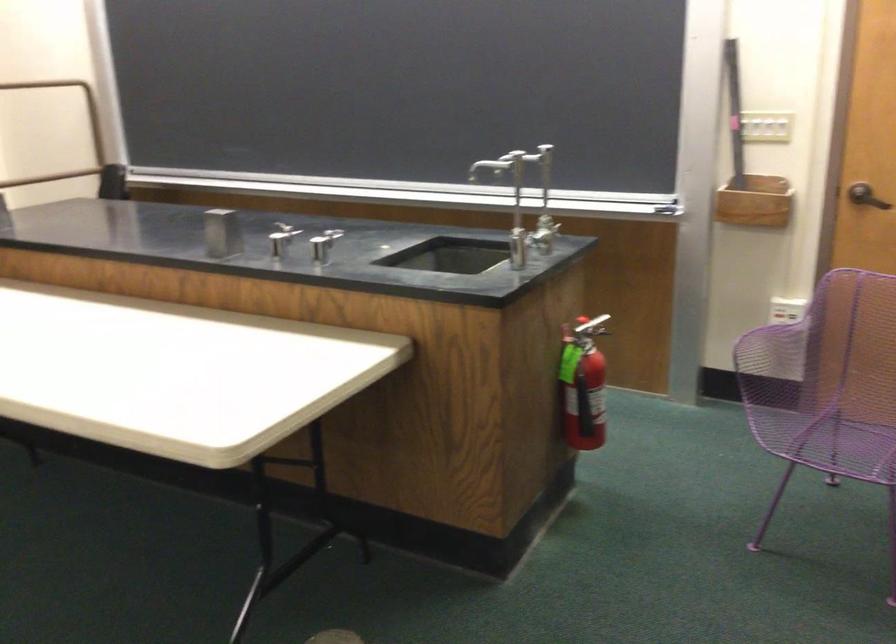
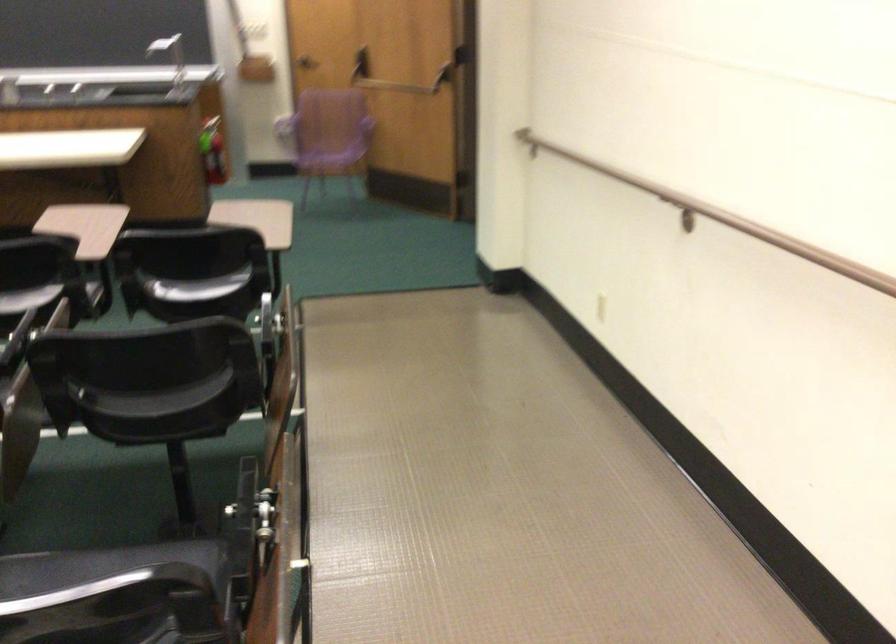
Question: I am providing you with two images of the same scene from different viewpoints. Which of the following objects are not visible in image2?

Choices:
 (A) red ladder latch
 (B) light switch
 (C) door pull handle
 (D) white light switch

Answer: (B)